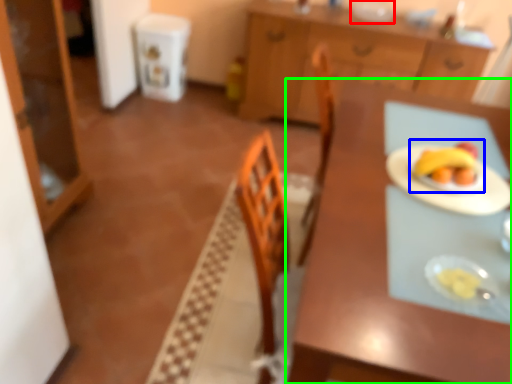
Question: Which object is the closest to the tableware (highlighted by a red box)? Choose among these: fruit dish (highlighted by a blue box) or table (highlighted by a green box).

Choices:
 (A) fruit dish
 (B) table

Answer: (A)